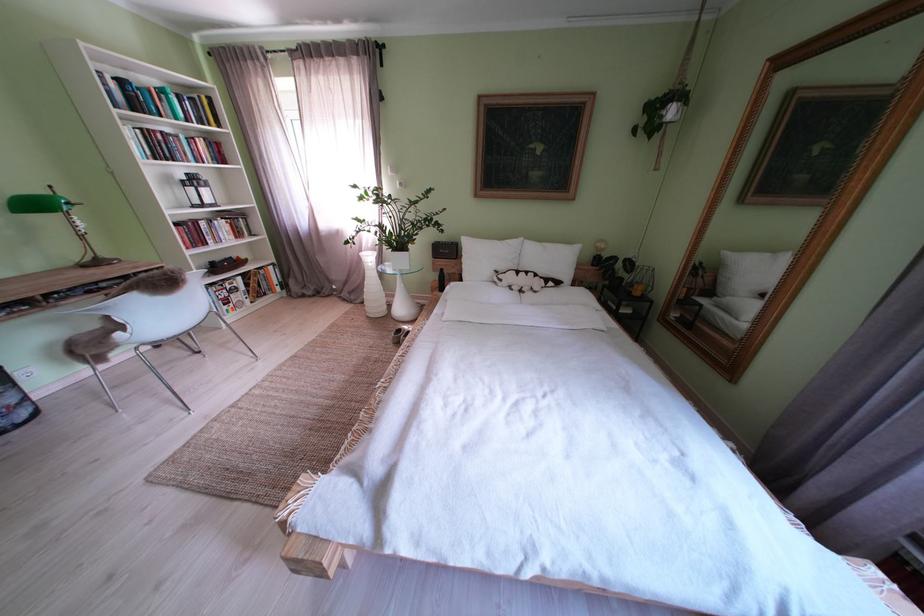
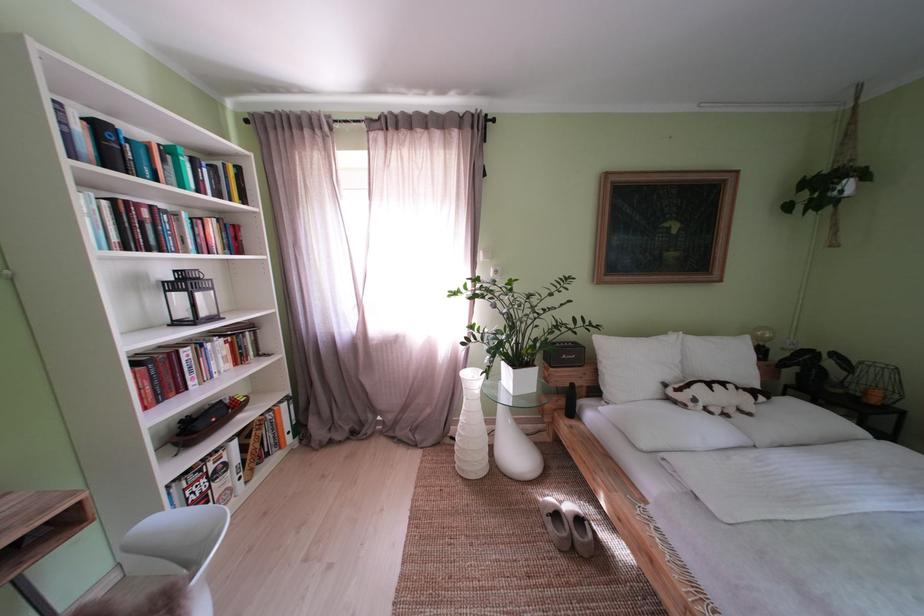
Locate, in the second image, the point that corresponds to (512,285) in the first image.

(706, 406)